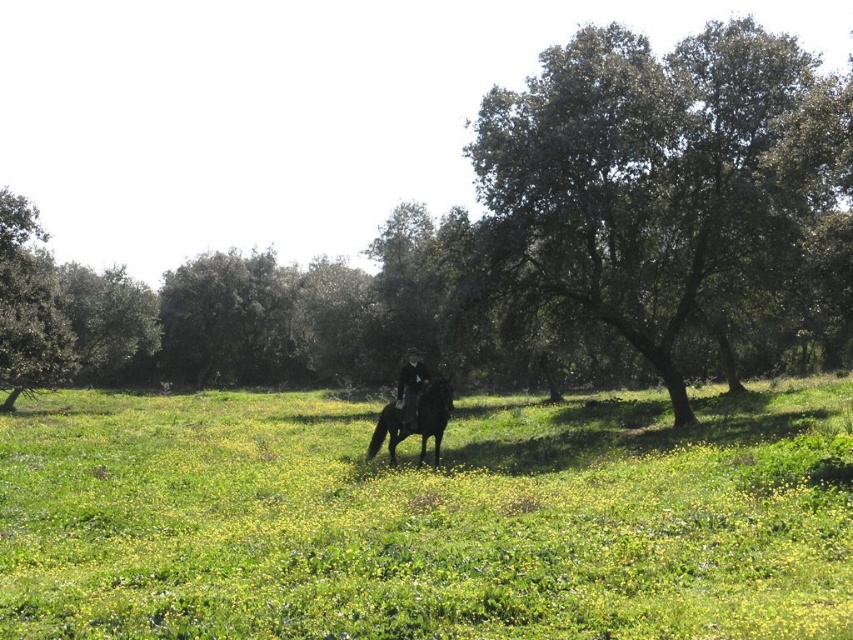
Does green leafy tree at left appear on the right side of shiny black horse at center?

In fact, green leafy tree at left is to the left of shiny black horse at center.

Identify the location of green leafy tree at left. Image resolution: width=853 pixels, height=640 pixels. 28,305.

Who is taller, green grassy pasture at center or green leafy tree at upper right?

green leafy tree at upper right is taller.

Locate an element on the screen. This screenshot has width=853, height=640. green grassy pasture at center is located at coordinates (426, 516).

Can you confirm if green leafy tree at upper right is shorter than green leafy tree at left?

In fact, green leafy tree at upper right may be taller than green leafy tree at left.

From the picture: Is green leafy tree at upper right below green leafy tree at left?

No.

Who is more forward, [547,227] or [55,346]?

Point [547,227]

What are the coordinates of `green leafy tree at upper right` in the screenshot? It's located at (648, 177).